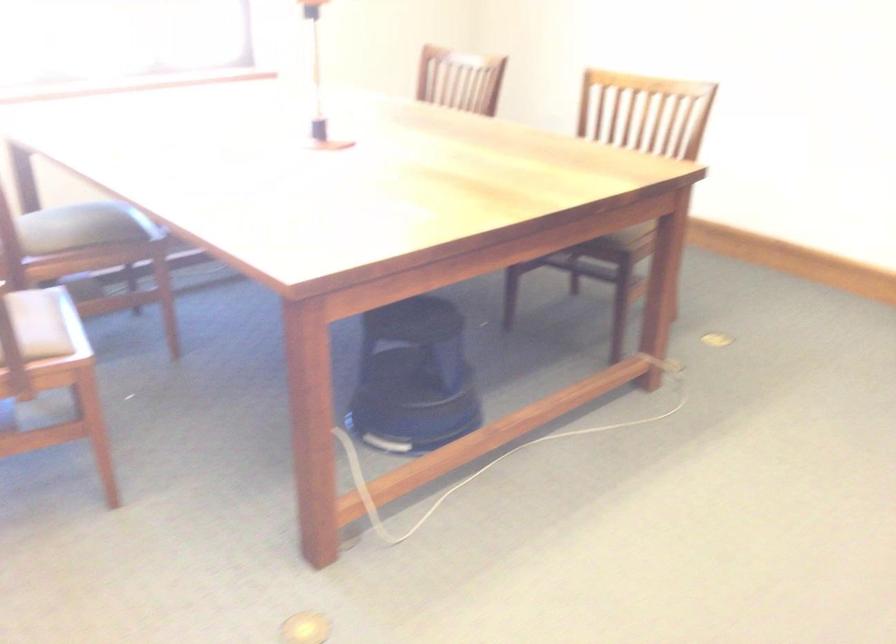
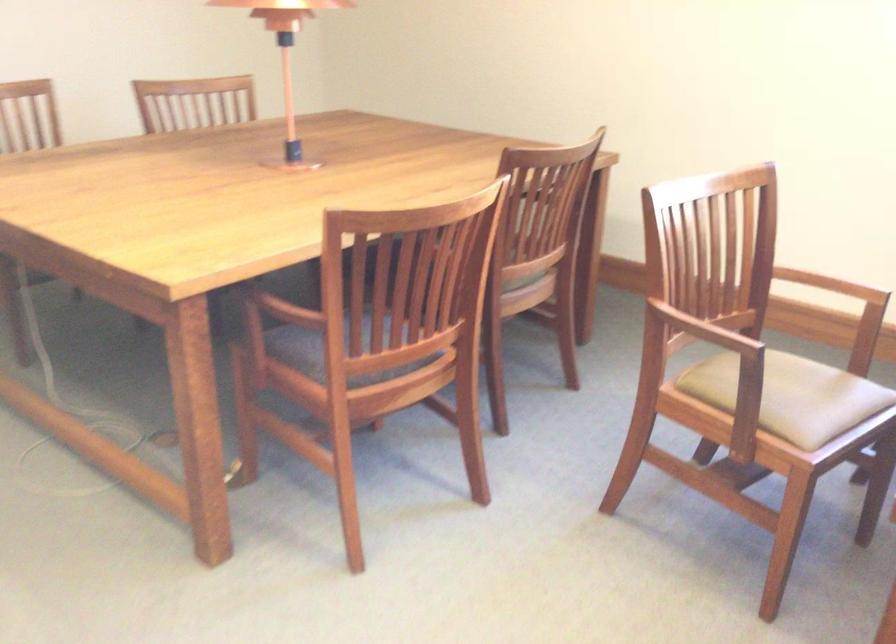
Question: The camera is either moving clockwise (left) or counter-clockwise (right) around the object. The first image is from the beginning of the video and the second image is from the end. Is the camera moving left or right when shooting the video?

Choices:
 (A) Left
 (B) Right

Answer: (B)